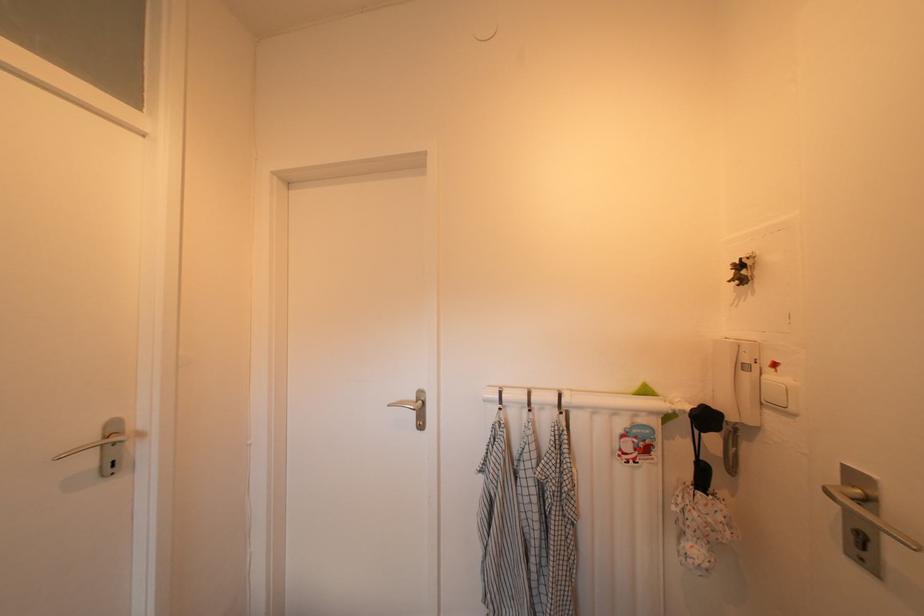
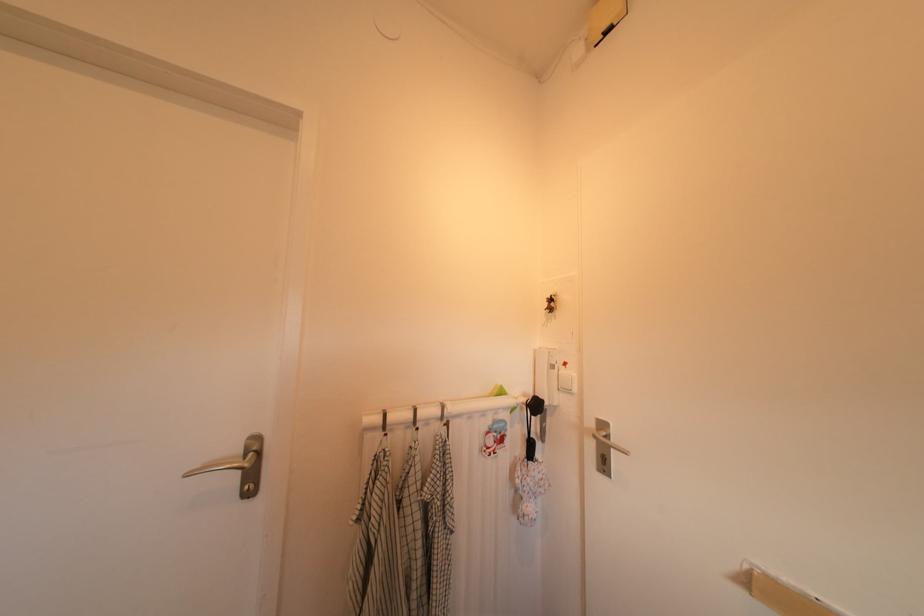
Question: The camera is either moving clockwise (left) or counter-clockwise (right) around the object. The first image is from the beginning of the video and the second image is from the end. Is the camera moving left or right when shooting the video?

Choices:
 (A) Left
 (B) Right

Answer: (A)